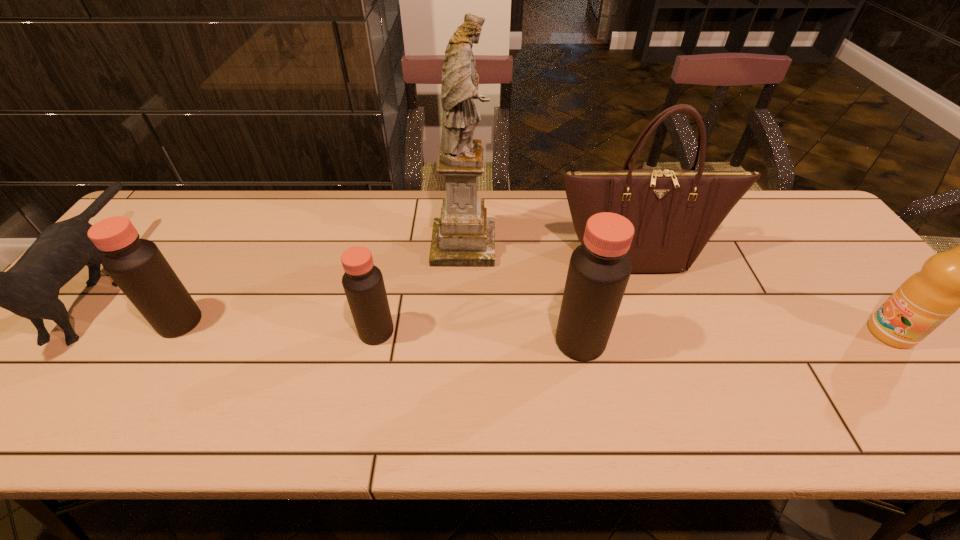
You are a GUI agent. You are given a task and a screenshot of the screen. Output one action in this format:
    pyautogui.click(x=<x>, y=<y>)
    Task: Click on the unoccupied area between the fourth object from left to right and the rightmost vinegar
    The height and width of the screenshot is (540, 960).
    Given the screenshot: What is the action you would take?
    pyautogui.click(x=522, y=293)

Identify which object is the third closest to the handbag. Please provide its 2D coordinates. Your answer should be formatted as a tuple, i.e. [(x, y)], where the tuple contains the x and y coordinates of a point satisfying the conditions above.

[(957, 278)]

This screenshot has height=540, width=960. Identify the location of object that is the third nearest to the rightmost vinegar. (363, 283).

Identify which vinegar is located as the nearest to the rightmost vinegar. Please provide its 2D coordinates. Your answer should be formatted as a tuple, i.e. [(x, y)], where the tuple contains the x and y coordinates of a point satisfying the conditions above.

[(363, 283)]

Locate an element on the screen. The height and width of the screenshot is (540, 960). vinegar that is the closest to the fifth object from right to left is located at coordinates (599, 270).

This screenshot has height=540, width=960. In order to click on blank area in the image that satisfies the following two spatial constraints: 1. on the front-facing side of the sculpture; 2. on the front-facing side of the leftmost object in this screenshot , I will do `click(462, 286)`.